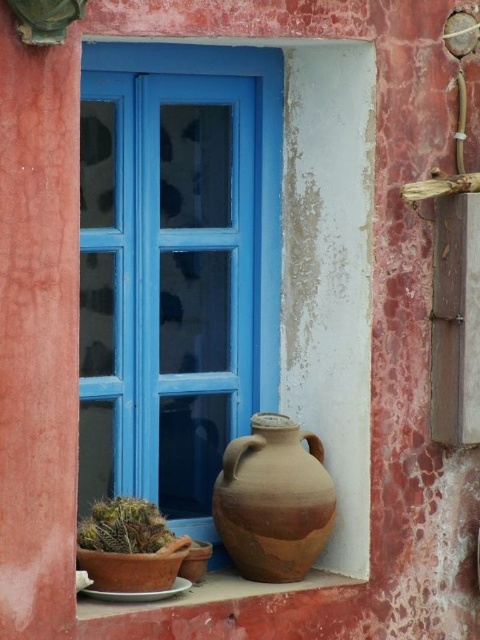
You are standing in front of a building with a blue framed window. There are two points marked on the wall. The first point is at coordinates point (298, 529) and the second point is at point (195, 564). Which of these two points is closer to you?

Point (298, 529) is closer to you because it is in front of point (195, 564).

You are a delivery person trying to deliver a package to the blue painted wood door at center. You are currently standing in front of the terracotta clay pot at lower left. Which direction should you move to reach the door?

The blue painted wood door at center is positioned on the right side of the terracotta clay pot at lower left, so you should move to your right to reach the door.

You are a delivery person trying to deliver a package to the blue painted wood door at center. There is a terracotta clay pot at lower left nearby. Can you place the package on the ground between them without it touching either object?

The blue painted wood door at center is larger in size than the terracotta clay pot at lower left, but the distance between them isn not specified. Without knowing the spacing, it is impossible to determine if the package can be placed between them without touching either object.